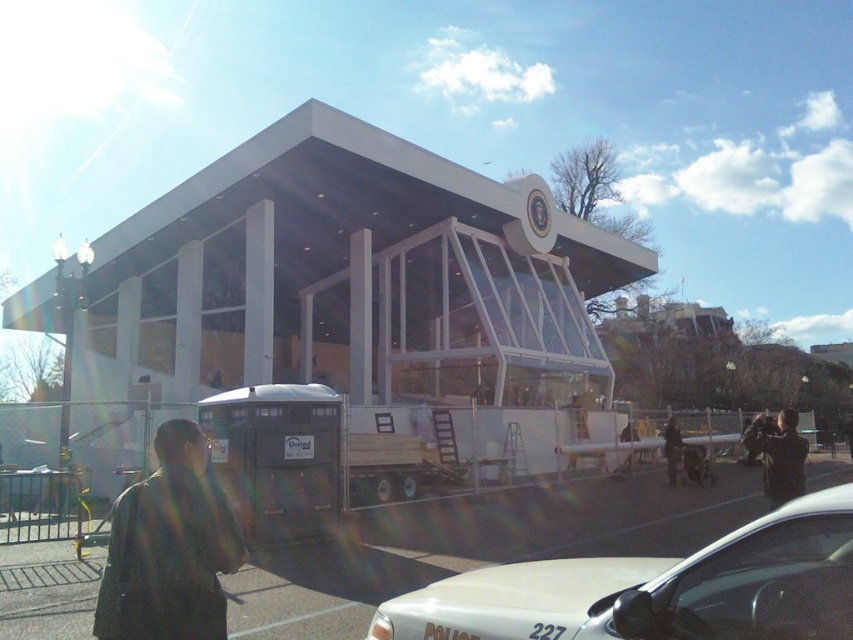
Question: Among these objects, which one is nearest to the camera?

Choices:
 (A) white glossy police car at lower center
 (B) dark brown leather jacket at lower right

Answer: (A)

Question: Can you confirm if dark brown leather jacket at lower left is bigger than dark brown leather jacket at lower right?

Choices:
 (A) yes
 (B) no

Answer: (B)

Question: Which of the following is the farthest from the observer?

Choices:
 (A) (778, 444)
 (B) (663, 448)

Answer: (B)

Question: Can you confirm if dark brown leather jacket at lower left is thinner than black leather jacket at lower right?

Choices:
 (A) yes
 (B) no

Answer: (A)

Question: Does dark brown leather jacket at lower left have a larger size compared to black leather jacket at lower right?

Choices:
 (A) no
 (B) yes

Answer: (A)

Question: Which of the following is the farthest from the observer?

Choices:
 (A) (668, 461)
 (B) (585, 604)

Answer: (A)